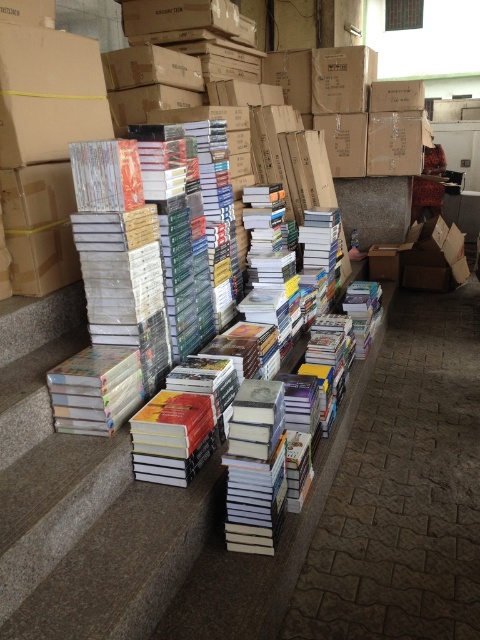
Question: Is matte brown cardboard box at upper left above brown cardboard box at center?

Choices:
 (A) no
 (B) yes

Answer: (A)

Question: Among these points, which one is farthest from the camera?

Choices:
 (A) (338, 83)
 (B) (38, 106)

Answer: (A)

Question: Which point appears closest to the camera in this image?

Choices:
 (A) (25, 48)
 (B) (335, 90)

Answer: (A)

Question: Can you confirm if matte brown cardboard box at upper left is smaller than brown cardboard box at center?

Choices:
 (A) yes
 (B) no

Answer: (B)

Question: Can you confirm if matte brown cardboard box at upper left is positioned to the right of brown cardboard box at center?

Choices:
 (A) no
 (B) yes

Answer: (A)